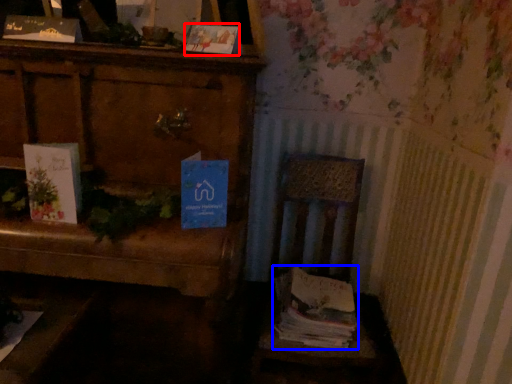
Question: Which point is further to the camera, paperback book (highlighted by a red box) or magazine (highlighted by a blue box)?

Choices:
 (A) paperback book
 (B) magazine

Answer: (B)